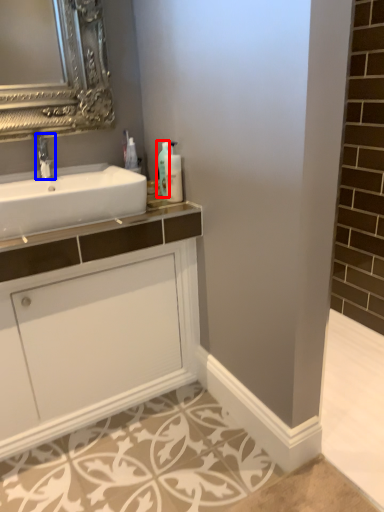
Question: Among these objects, which one is farthest to the camera, soap dispenser (highlighted by a red box) or tap (highlighted by a blue box)?

Choices:
 (A) soap dispenser
 (B) tap

Answer: (A)